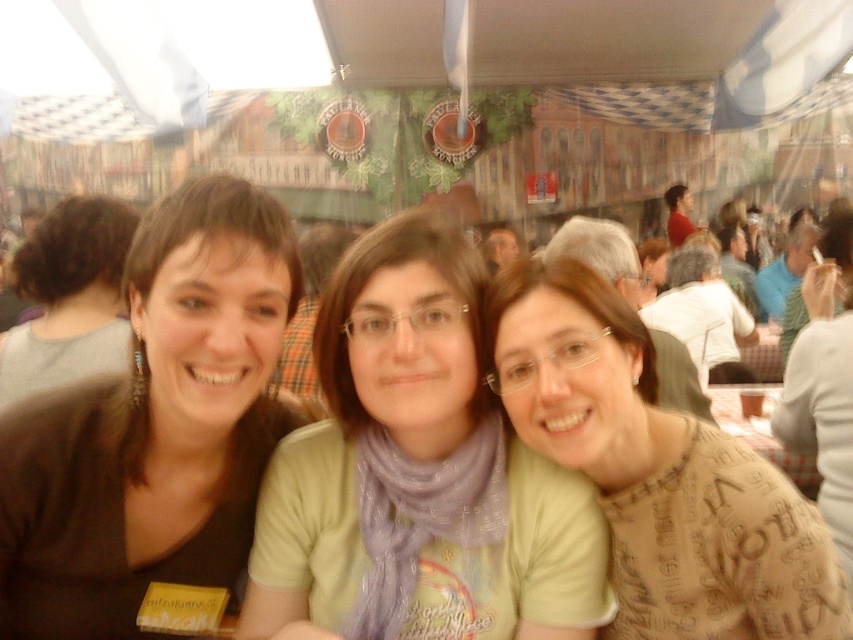
Is light green t-shirt at center to the right of matte red shirt at center from the viewer's perspective?

Incorrect, light green t-shirt at center is not on the right side of matte red shirt at center.

From the picture: Can you confirm if light green t-shirt at center is taller than matte red shirt at center?

Yes.

Does point (392, 452) lie behind point (676, 209)?

No, (392, 452) is closer to viewer.

Where is `light green t-shirt at center`? The width and height of the screenshot is (853, 640). light green t-shirt at center is located at coordinates (418, 474).

Does brown matte shirt at left appear over matte red shirt at center?

No, brown matte shirt at left is not above matte red shirt at center.

Does brown matte shirt at left lie behind matte red shirt at center?

That is False.

Image resolution: width=853 pixels, height=640 pixels. What do you see at coordinates (155, 426) in the screenshot?
I see `brown matte shirt at left` at bounding box center [155, 426].

This screenshot has height=640, width=853. I want to click on brown matte shirt at left, so click(x=155, y=426).

Is brown matte shirt at left taller than brown hair at left?

Indeed, brown matte shirt at left has a greater height compared to brown hair at left.

Can you confirm if brown matte shirt at left is wider than brown hair at left?

In fact, brown matte shirt at left might be narrower than brown hair at left.

The image size is (853, 640). What do you see at coordinates (155, 426) in the screenshot?
I see `brown matte shirt at left` at bounding box center [155, 426].

Image resolution: width=853 pixels, height=640 pixels. What are the coordinates of `brown matte shirt at left` in the screenshot? It's located at (155, 426).